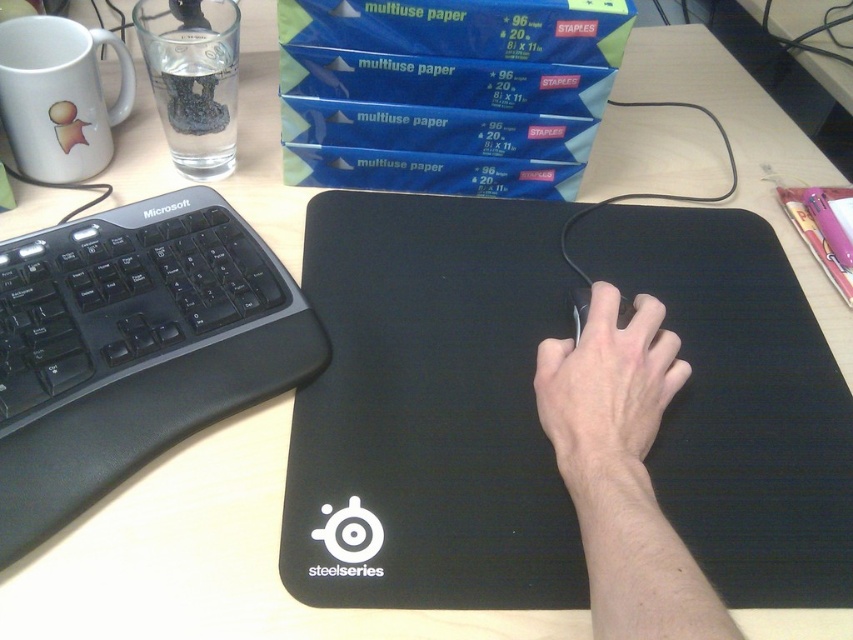
Is black matte keyboard at left thinner than skinny white hand at center?

No.

Who is more distant from viewer, [22,371] or [619,422]?

Positioned behind is point [22,371].

This screenshot has height=640, width=853. In order to click on black matte keyboard at left in this screenshot , I will do `click(132, 348)`.

The width and height of the screenshot is (853, 640). In order to click on black matte keyboard at left in this screenshot , I will do `click(132, 348)`.

Between black rubber mousepad at center and black matte mouse at center, which one has less height?

black matte mouse at center

Does black rubber mousepad at center have a lesser width compared to black matte mouse at center?

Incorrect, black rubber mousepad at center's width is not less than black matte mouse at center's.

Between point (364, 424) and point (573, 308), which one is positioned behind?

The point (573, 308) is behind.

Find the location of a particular element. black rubber mousepad at center is located at coordinates (428, 408).

Is black matte keyboard at left smaller than black matte mouse at center?

No, black matte keyboard at left is not smaller than black matte mouse at center.

Does black matte keyboard at left have a greater width compared to black matte mouse at center?

Yes, black matte keyboard at left is wider than black matte mouse at center.

The width and height of the screenshot is (853, 640). What are the coordinates of `black matte keyboard at left` in the screenshot? It's located at (132, 348).